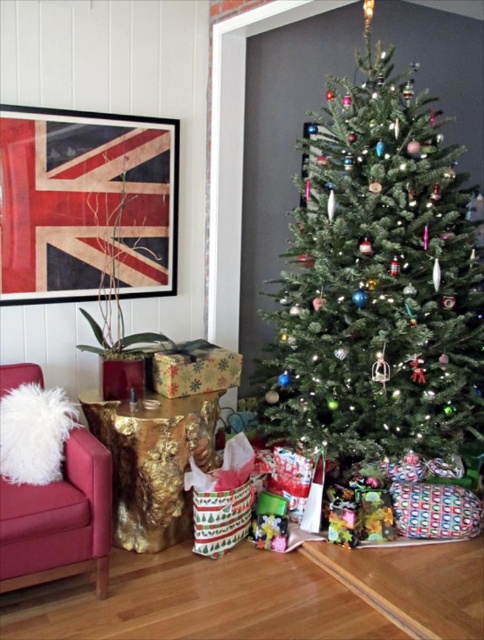
Does velvet red armchair at lower left have a lesser height compared to shiny gold wrapping paper at lower center?

No.

Between velvet red armchair at lower left and shiny gold wrapping paper at lower center, which one has less height?

Standing shorter between the two is shiny gold wrapping paper at lower center.

The width and height of the screenshot is (484, 640). Identify the location of velvet red armchair at lower left. (59, 520).

Between green matte christmas tree at center and velvet red armchair at lower left, which one has more height?

With more height is green matte christmas tree at center.

Is green matte christmas tree at center smaller than velvet red armchair at lower left?

Actually, green matte christmas tree at center might be larger than velvet red armchair at lower left.

Image resolution: width=484 pixels, height=640 pixels. Describe the element at coordinates (377, 280) in the screenshot. I see `green matte christmas tree at center` at that location.

The image size is (484, 640). I want to click on green matte christmas tree at center, so click(377, 280).

Who is lower down, green matte christmas tree at center or shiny gold wrapping paper at lower center?

shiny gold wrapping paper at lower center

Can you confirm if green matte christmas tree at center is positioned to the right of shiny gold wrapping paper at lower center?

Yes, green matte christmas tree at center is to the right of shiny gold wrapping paper at lower center.

You are a GUI agent. You are given a task and a screenshot of the screen. Output one action in this format:
    pyautogui.click(x=<x>, y=<y>)
    Task: Click on the green matte christmas tree at center
    This screenshot has height=640, width=484.
    Given the screenshot: What is the action you would take?
    pyautogui.click(x=377, y=280)